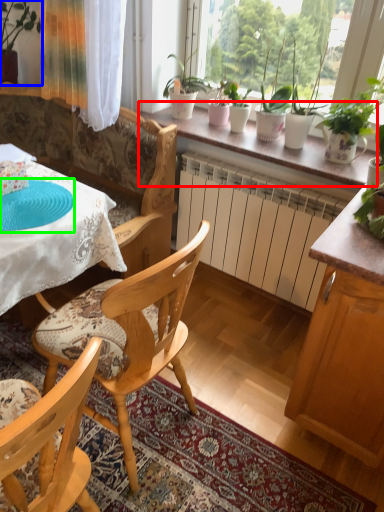
Question: Considering the real-world distances, which object is closest to window sill (highlighted by a red box)? houseplant (highlighted by a blue box) or paper plate (highlighted by a green box).

Choices:
 (A) houseplant
 (B) paper plate

Answer: (B)